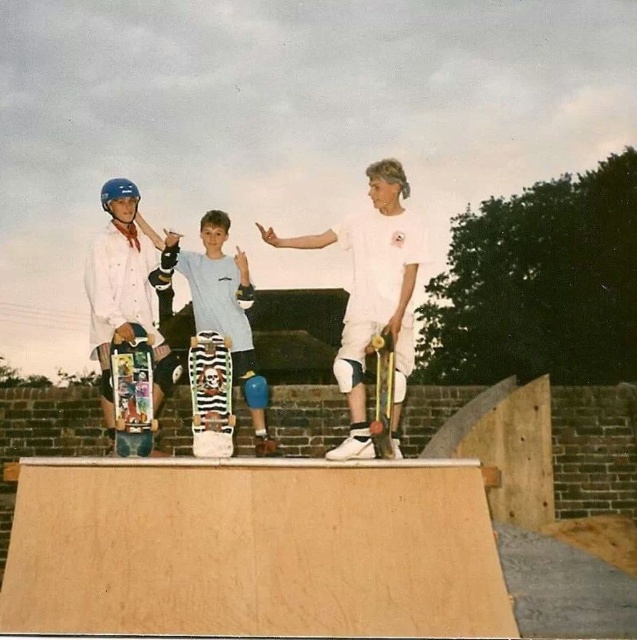
Question: Which point appears closest to the camera in this image?

Choices:
 (A) (111, 305)
 (B) (245, 256)
 (C) (380, 333)

Answer: (C)

Question: In this image, where is white matte skateboard at center located relative to striped wood skateboard at center?

Choices:
 (A) right
 (B) left

Answer: (A)

Question: Estimate the real-world distances between objects in this image. Which object is farther from the wooden textured skateboard at center?

Choices:
 (A) striped wood skateboard at center
 (B) matte black skateboard at center
 (C) white matte skateboard at center
 (D) striped skateboard at center

Answer: (B)

Question: Does white matte skateboard at center have a greater width compared to matte black skateboard at center?

Choices:
 (A) yes
 (B) no

Answer: (A)

Question: Which of the following is the closest to the observer?

Choices:
 (A) striped skateboard at center
 (B) wooden textured skateboard at center
 (C) multicolored graphic skateboard at center

Answer: (B)

Question: Is white matte skateboard at center smaller than matte black skateboard at center?

Choices:
 (A) no
 (B) yes

Answer: (A)